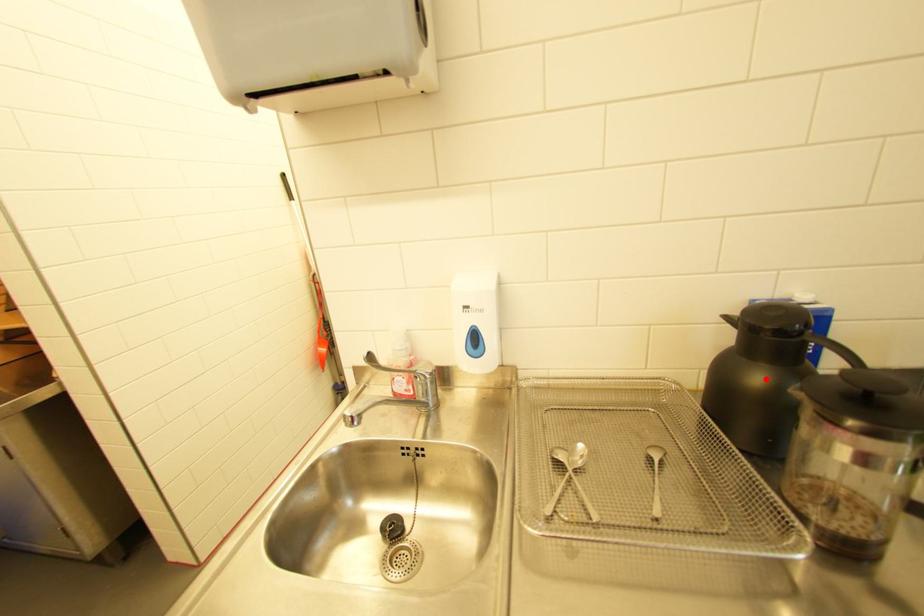
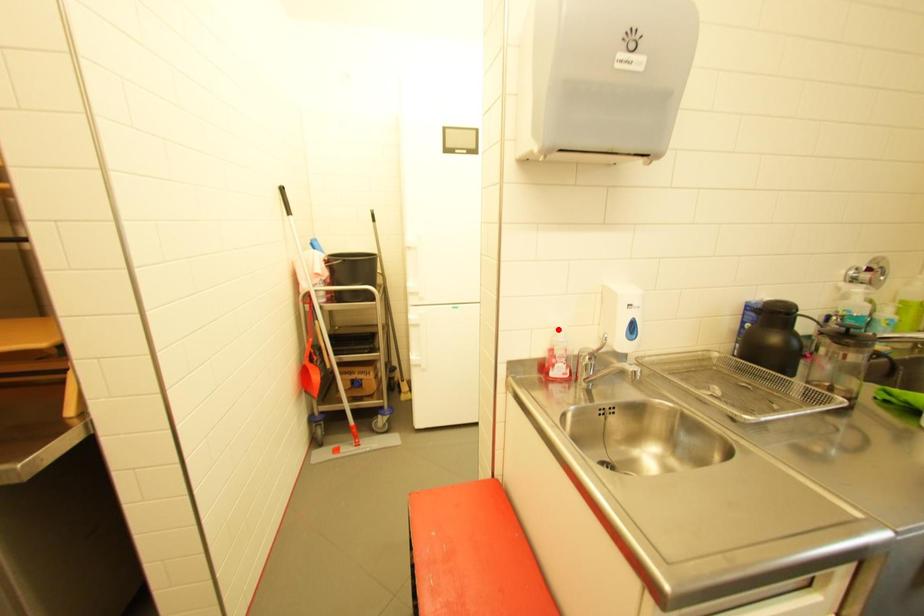
I am providing you with two images of the same scene from different viewpoints. A red point is marked on the first image and another point is marked on the second image. Does the point marked in image1 correspond to the same location as the one in image2?

No